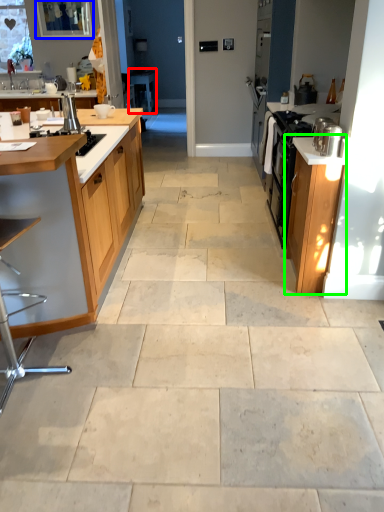
Question: Which object is the farthest from table (highlighted by a red box)? Choose among these: window screen (highlighted by a blue box) or cabinetry (highlighted by a green box).

Choices:
 (A) window screen
 (B) cabinetry

Answer: (B)